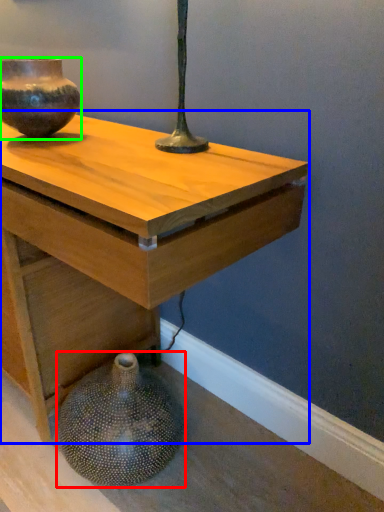
Question: Estimate the real-world distances between objects in this image. Which object is closer to vase (highlighted by a red box), table (highlighted by a blue box) or vase (highlighted by a green box)?

Choices:
 (A) table
 (B) vase

Answer: (A)